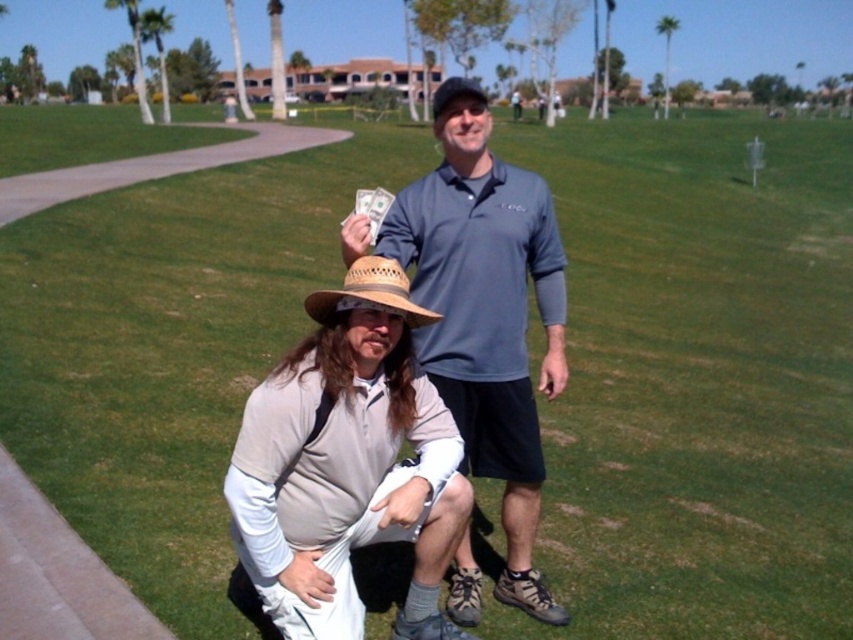
Who is shorter, straw woven hat at center or green leafy palm tree at upper center?

With less height is straw woven hat at center.

Does point (329, 307) come farther from viewer compared to point (664, 84)?

No, it is in front of (664, 84).

This screenshot has width=853, height=640. In order to click on straw woven hat at center in this screenshot , I will do `click(372, 291)`.

Does point (337, 483) come closer to viewer compared to point (440, 186)?

Yes, point (337, 483) is in front of point (440, 186).

Which is more to the right, beige cotton hat at lower center or matte blue shirt at center?

matte blue shirt at center is more to the right.

Who is more distant from viewer, (296,584) or (525,556)?

The point (525,556) is behind.

Identify the location of beige cotton hat at lower center. The width and height of the screenshot is (853, 640). (346, 465).

Is straw woven hat at center closer to the viewer compared to black fabric hat at upper center?

Yes, it is in front of black fabric hat at upper center.

Is straw woven hat at center bigger than black fabric hat at upper center?

No, straw woven hat at center is not bigger than black fabric hat at upper center.

Describe the element at coordinates (372, 291) in the screenshot. Image resolution: width=853 pixels, height=640 pixels. I see `straw woven hat at center` at that location.

What are the coordinates of `straw woven hat at center` in the screenshot? It's located at (372, 291).